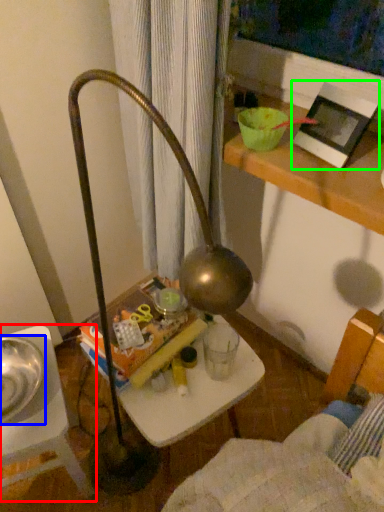
Question: Which object is positioned farthest from furniture (highlighted by a red box)? Select from glass bowl (highlighted by a blue box) and picture frame (highlighted by a green box).

Choices:
 (A) glass bowl
 (B) picture frame

Answer: (B)